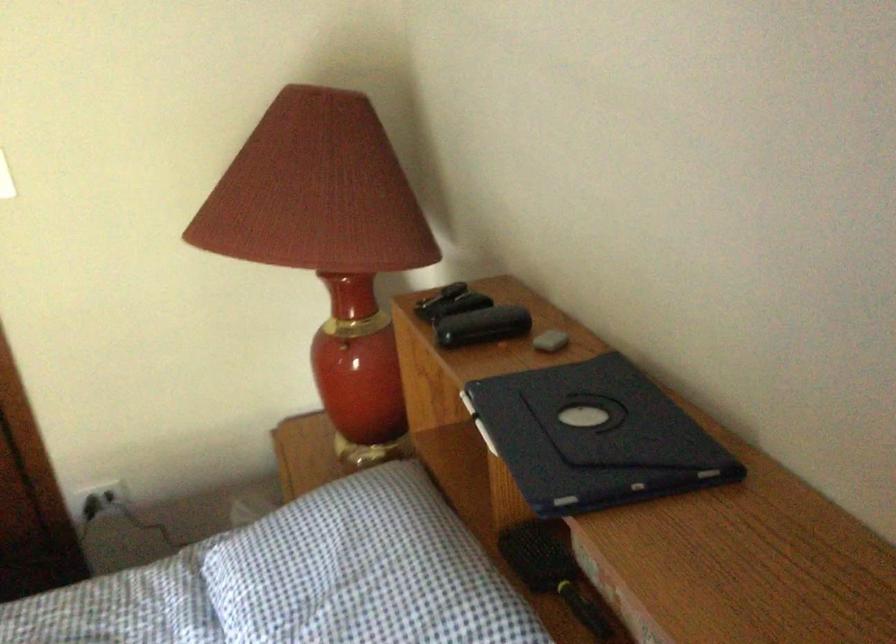
The width and height of the screenshot is (896, 644). What do you see at coordinates (552, 571) in the screenshot? I see `the black hairbrush` at bounding box center [552, 571].